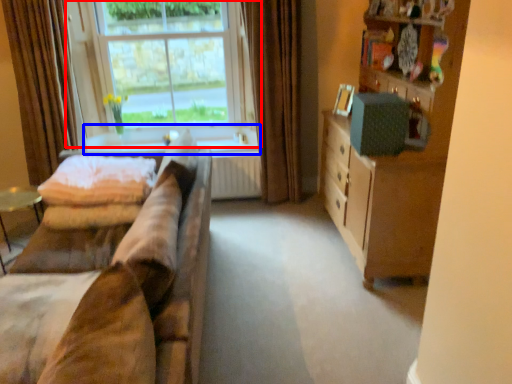
Question: Which object appears farthest to the camera in this image, window (highlighted by a red box) or window sill (highlighted by a blue box)?

Choices:
 (A) window
 (B) window sill

Answer: (B)